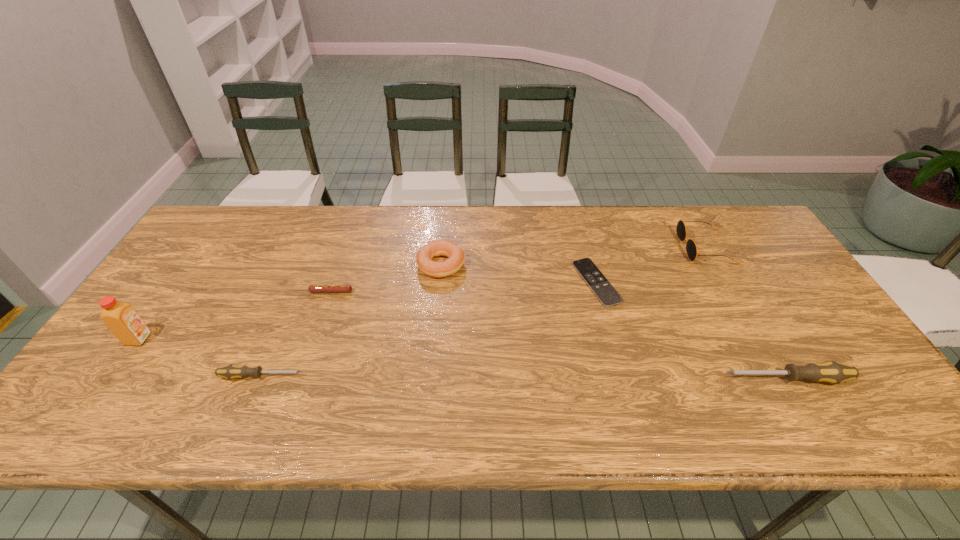
The width and height of the screenshot is (960, 540). Find the location of `vacant space located 0.390m at the tip of the fifth tallest object`. vacant space located 0.390m at the tip of the fifth tallest object is located at coordinates (469, 376).

The image size is (960, 540). In order to click on free space located 0.380m at the tip of the right screwdriver in this screenshot , I will do (560, 379).

Where is `free space located at the tip of the right screwdriver`? free space located at the tip of the right screwdriver is located at coordinates (640, 379).

Where is `blank space located 0.300m at the tip of the right screwdriver`? The width and height of the screenshot is (960, 540). blank space located 0.300m at the tip of the right screwdriver is located at coordinates (593, 379).

At what (x,y) coordinates should I click in order to perform the action: click on vacant point located on the right of the shortest object. Please return your answer as a coordinate pair (x, y). The height and width of the screenshot is (540, 960). Looking at the image, I should click on (676, 282).

What are the coordinates of `vacant space located on the left of the sausage` in the screenshot? It's located at (242, 292).

Locate an element on the screen. The height and width of the screenshot is (540, 960). vacant space located on the front and back of the leftmost object is located at coordinates (275, 339).

Locate an element on the screen. vacant space positioned 0.180m on the right of the bagel is located at coordinates (525, 265).

You are a GUI agent. You are given a task and a screenshot of the screen. Output one action in this format:
    pyautogui.click(x=<x>, y=<y>)
    Task: Click on the free space located 0.140m on the front-facing side of the sunglasses
    The height and width of the screenshot is (540, 960).
    Given the screenshot: What is the action you would take?
    pyautogui.click(x=636, y=247)

I want to click on vacant area situated 0.230m on the front-facing side of the sunglasses, so click(608, 247).